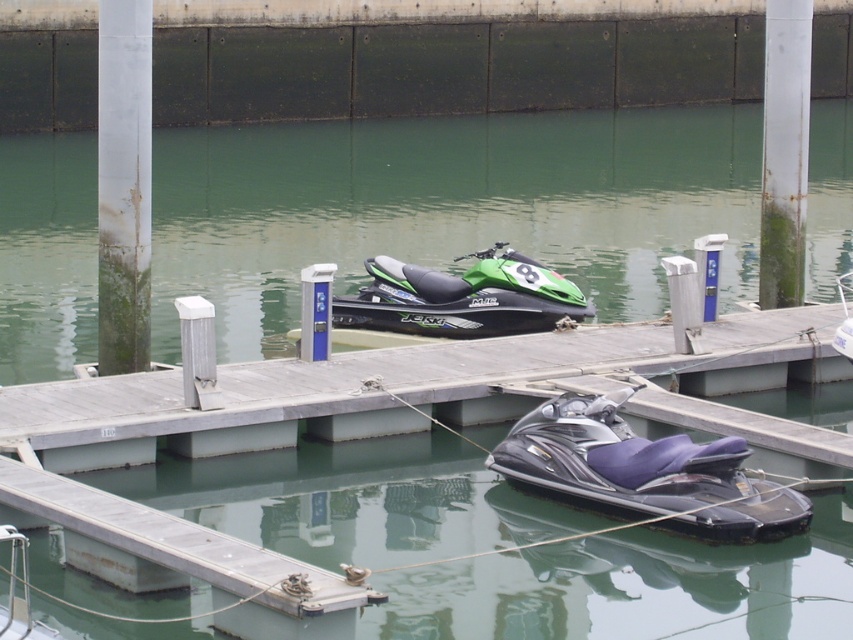
Question: Which of these objects is positioned closest to the smooth gray dock at center?

Choices:
 (A) shiny black jet ski at lower center
 (B) green matte jet ski at center

Answer: (B)

Question: Which of these objects is positioned closest to the shiny black jet ski at lower center?

Choices:
 (A) smooth gray dock at center
 (B) green matte jet ski at center

Answer: (A)

Question: Does smooth gray dock at center appear under shiny black jet ski at lower center?

Choices:
 (A) yes
 (B) no

Answer: (B)

Question: Which of the following is the closest to the observer?

Choices:
 (A) (483, 259)
 (B) (611, 477)
 (C) (548, 333)

Answer: (B)

Question: Can you confirm if smooth gray dock at center is smaller than shiny black jet ski at lower center?

Choices:
 (A) no
 (B) yes

Answer: (B)

Question: Is smooth gray dock at center bigger than shiny black jet ski at lower center?

Choices:
 (A) no
 (B) yes

Answer: (A)